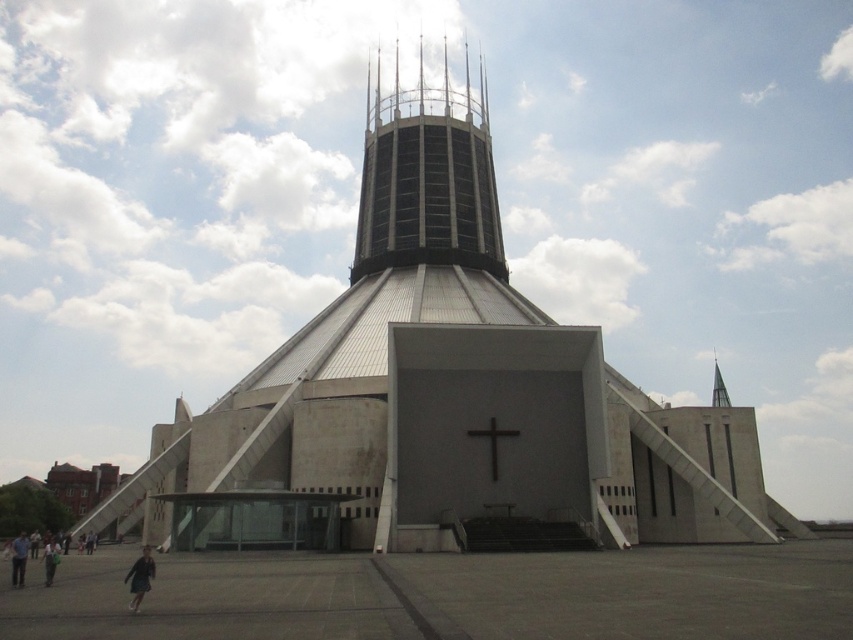
Does dark blue coat at lower left have a lesser width compared to dark gray fabric jacket at lower left?

Correct, dark blue coat at lower left's width is less than dark gray fabric jacket at lower left's.

The width and height of the screenshot is (853, 640). Describe the element at coordinates (140, 577) in the screenshot. I see `dark blue coat at lower left` at that location.

This screenshot has height=640, width=853. What do you see at coordinates (140, 577) in the screenshot? I see `dark blue coat at lower left` at bounding box center [140, 577].

The height and width of the screenshot is (640, 853). I want to click on dark blue coat at lower left, so click(x=140, y=577).

Is point (50, 577) more distant than point (718, 388)?

No, it is not.

Who is shorter, dark gray fabric jacket at lower left or shiny silver spire at upper right?

With less height is dark gray fabric jacket at lower left.

Which is in front, point (44, 547) or point (722, 387)?

Point (44, 547) is more forward.

The height and width of the screenshot is (640, 853). What are the coordinates of `dark gray fabric jacket at lower left` in the screenshot? It's located at (50, 560).

Between white concrete church at center and shiny silver spire at upper right, which one appears on the right side from the viewer's perspective?

Positioned to the right is shiny silver spire at upper right.

Looking at this image, who is more forward, (508, 438) or (730, 403)?

Point (508, 438) is in front.

This screenshot has width=853, height=640. Identify the location of white concrete church at center. (448, 387).